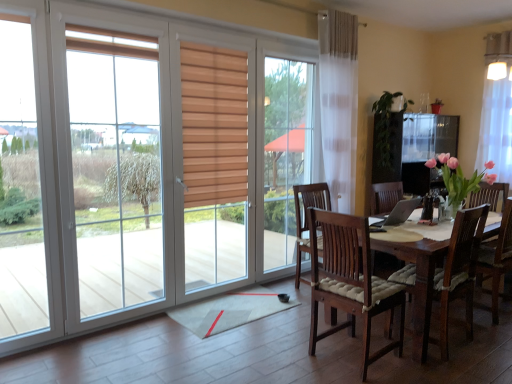
Question: From the image's perspective, is white sheer curtain at upper right located beneath silver metallic laptop at center?

Choices:
 (A) no
 (B) yes

Answer: (A)

Question: Can you confirm if white sheer curtain at upper right is positioned to the right of silver metallic laptop at center?

Choices:
 (A) no
 (B) yes

Answer: (B)

Question: Is the depth of white sheer curtain at upper right less than that of silver metallic laptop at center?

Choices:
 (A) yes
 (B) no

Answer: (B)

Question: Considering the relative sizes of white sheer curtain at upper right and silver metallic laptop at center in the image provided, is white sheer curtain at upper right smaller than silver metallic laptop at center?

Choices:
 (A) yes
 (B) no

Answer: (B)

Question: Considering the relative sizes of white sheer curtain at upper right and silver metallic laptop at center in the image provided, is white sheer curtain at upper right shorter than silver metallic laptop at center?

Choices:
 (A) no
 (B) yes

Answer: (A)

Question: Considering the relative sizes of white sheer curtain at upper right and silver metallic laptop at center in the image provided, is white sheer curtain at upper right thinner than silver metallic laptop at center?

Choices:
 (A) no
 (B) yes

Answer: (B)

Question: Can you confirm if silver metallic laptop at center is taller than white sheer curtain at upper right?

Choices:
 (A) yes
 (B) no

Answer: (B)

Question: From the image's perspective, is silver metallic laptop at center on white sheer curtain at upper right?

Choices:
 (A) yes
 (B) no

Answer: (B)

Question: Is silver metallic laptop at center not within white sheer curtain at upper right?

Choices:
 (A) no
 (B) yes

Answer: (B)

Question: Is silver metallic laptop at center positioned with its back to white sheer curtain at upper right?

Choices:
 (A) yes
 (B) no

Answer: (B)

Question: Is silver metallic laptop at center shorter than white sheer curtain at upper right?

Choices:
 (A) no
 (B) yes

Answer: (B)

Question: From a real-world perspective, is silver metallic laptop at center physically above white sheer curtain at upper right?

Choices:
 (A) no
 (B) yes

Answer: (A)

Question: Is silver metallic laptop at center inside or outside of white sheer curtain at upper right?

Choices:
 (A) outside
 (B) inside

Answer: (A)